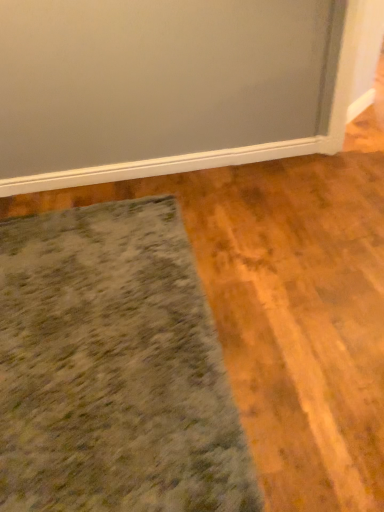
In order to face green shaggy rug at lower left, should I rotate leftwards or rightwards?

To align with it, rotate left about 14.234°.

What are the coordinates of `green shaggy rug at lower left` in the screenshot? It's located at (113, 369).

The height and width of the screenshot is (512, 384). Describe the element at coordinates (113, 369) in the screenshot. I see `green shaggy rug at lower left` at that location.

Identify the location of green shaggy rug at lower left. This screenshot has height=512, width=384. (113, 369).